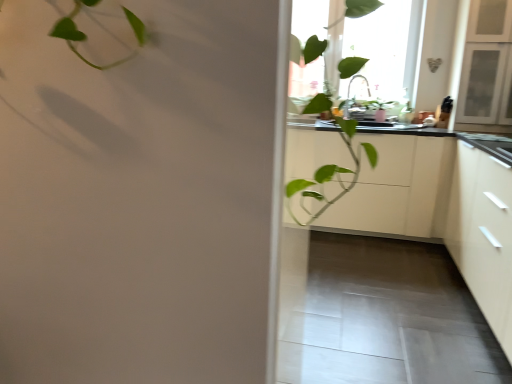
Question: From a real-world perspective, is white matte cabinet at center, the first cabinetry in the back-to-front sequence, physically below white matte cabinet at right, the 1th cabinetry in the front-to-back sequence?

Choices:
 (A) no
 (B) yes

Answer: (B)

Question: Is the position of white matte cabinet at center, the first cabinetry in the back-to-front sequence, more distant than that of white matte cabinet at right, the 1th cabinetry in the front-to-back sequence?

Choices:
 (A) no
 (B) yes

Answer: (B)

Question: Would you consider white matte cabinet at center, the first cabinetry in the back-to-front sequence, to be distant from white matte cabinet at right, the second cabinetry viewed from the back?

Choices:
 (A) no
 (B) yes

Answer: (A)

Question: Would you say white matte cabinet at center, the 2th cabinetry when ordered from front to back, contains white matte cabinet at right, the 1th cabinetry in the front-to-back sequence?

Choices:
 (A) yes
 (B) no

Answer: (B)

Question: Does white matte cabinet at center, the first cabinetry in the back-to-front sequence, appear on the left side of white matte cabinet at right, the second cabinetry viewed from the back?

Choices:
 (A) no
 (B) yes

Answer: (B)

Question: Is white matte cabinet at center, the first cabinetry in the back-to-front sequence, oriented away from white matte cabinet at right, the 1th cabinetry in the front-to-back sequence?

Choices:
 (A) no
 (B) yes

Answer: (A)

Question: From the image's perspective, does white matte cabinet at right, the second cabinetry viewed from the back, appear higher than black matte countertop at center?

Choices:
 (A) yes
 (B) no

Answer: (A)

Question: Considering the relative sizes of white matte cabinet at right, the 1th cabinetry in the front-to-back sequence, and black matte countertop at center in the image provided, is white matte cabinet at right, the 1th cabinetry in the front-to-back sequence, wider than black matte countertop at center?

Choices:
 (A) no
 (B) yes

Answer: (A)

Question: From the image's perspective, is white matte cabinet at right, the second cabinetry viewed from the back, beneath black matte countertop at center?

Choices:
 (A) no
 (B) yes

Answer: (A)

Question: Would you say black matte countertop at center is part of white matte cabinet at right, the second cabinetry viewed from the back,'s contents?

Choices:
 (A) no
 (B) yes

Answer: (B)

Question: Considering the relative sizes of white matte cabinet at right, the 1th cabinetry in the front-to-back sequence, and black matte countertop at center in the image provided, is white matte cabinet at right, the 1th cabinetry in the front-to-back sequence, taller than black matte countertop at center?

Choices:
 (A) no
 (B) yes

Answer: (B)

Question: From a real-world perspective, is white matte cabinet at right, the 1th cabinetry in the front-to-back sequence, under black matte countertop at center?

Choices:
 (A) no
 (B) yes

Answer: (B)